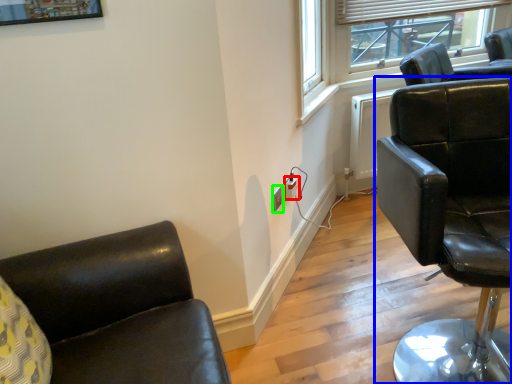
Question: Which object is the closest to the electric outlet (highlighted by a red box)? Choose among these: chair (highlighted by a blue box) or electric outlet (highlighted by a green box).

Choices:
 (A) chair
 (B) electric outlet

Answer: (B)